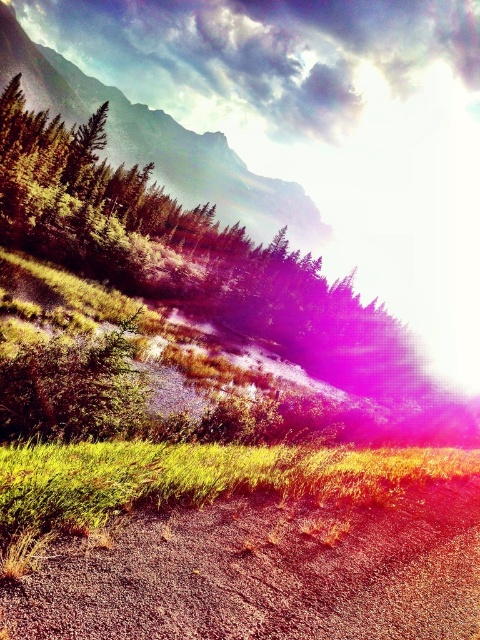
You are planning to drive a car that is 2 meters wide along the brown gravel dirt track at lower center. Based on the scene, can the car fit on the track? Please consider the width of the track compared to the green textured mountain at upper left.

The brown gravel dirt track at lower center is narrower than the green textured mountain at upper left. Since the car is 2 meters wide, it may not fit on the track if the track is narrower than 2 meters. However, without knowing the exact width of the mountain, we cannot determine the track width precisely. Therefore, it is uncertain if the car can fit.

You are standing at the edge of the brown gravel dirt track at lower center and want to walk towards the green textured mountain at upper left. Which direction should you head?

You should head to the left because the green textured mountain at upper left is located to the left of the brown gravel dirt track at lower center.